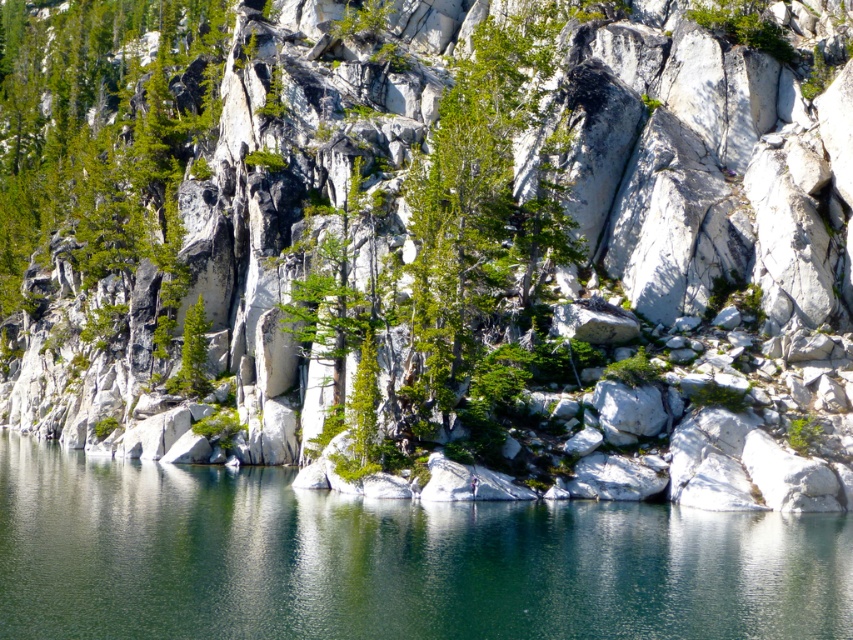
You are a hiker standing at the base of the cliff and want to cross the green marble water at center. The green leafy tree at center is blocking your path. Can you walk around the tree to reach the water?

The green marble water at center is shorter than the green leafy tree at center, so the tree is taller and may block the path. You might need to find another route or go around the tree to access the water.

You are a hiker standing at the base of the cliff and want to reach the green leafy tree at center. Is the green marble water at center blocking your path?

The green marble water at center is below the green leafy tree at center, so the water is not blocking your path to the tree. You can climb up the cliff to reach the green leafy tree at center.